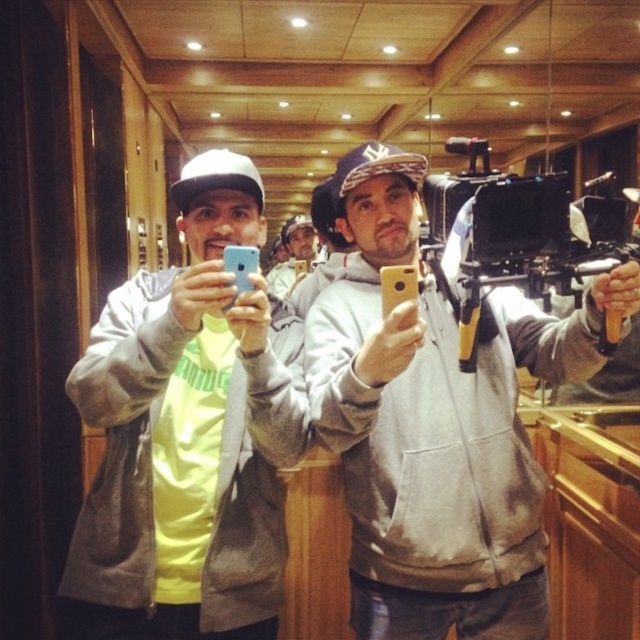
Does gray matte hoodie at center appear on the left side of black plastic video camera at center right?

Yes, gray matte hoodie at center is to the left of black plastic video camera at center right.

Is gray matte hoodie at center further to the viewer compared to black plastic video camera at center right?

No.

Who is more forward, (460, 468) or (467, 308)?

Point (467, 308) is more forward.

Identify the location of gray matte hoodie at center. The height and width of the screenshot is (640, 640). (436, 422).

Does gray matte hoodie at center appear on the right side of matte yellow shirt at center?

Indeed, gray matte hoodie at center is positioned on the right side of matte yellow shirt at center.

Between gray matte hoodie at center and matte yellow shirt at center, which one has more height?

Standing taller between the two is gray matte hoodie at center.

Identify the location of gray matte hoodie at center. (436, 422).

Image resolution: width=640 pixels, height=640 pixels. In order to click on gray matte hoodie at center in this screenshot , I will do `click(436, 422)`.

Measure the distance between black plastic video camera at center right and matte yellow shirt at center.

black plastic video camera at center right is 12.40 feet from matte yellow shirt at center.

Which is behind, point (429, 227) or point (288, 273)?

The point (288, 273) is behind.

The image size is (640, 640). Identify the location of black plastic video camera at center right. (515, 237).

You are a GUI agent. You are given a task and a screenshot of the screen. Output one action in this format:
    pyautogui.click(x=<x>, y=<y>)
    Task: Click on the black plastic video camera at center right
    This screenshot has height=640, width=640.
    Given the screenshot: What is the action you would take?
    pyautogui.click(x=515, y=237)